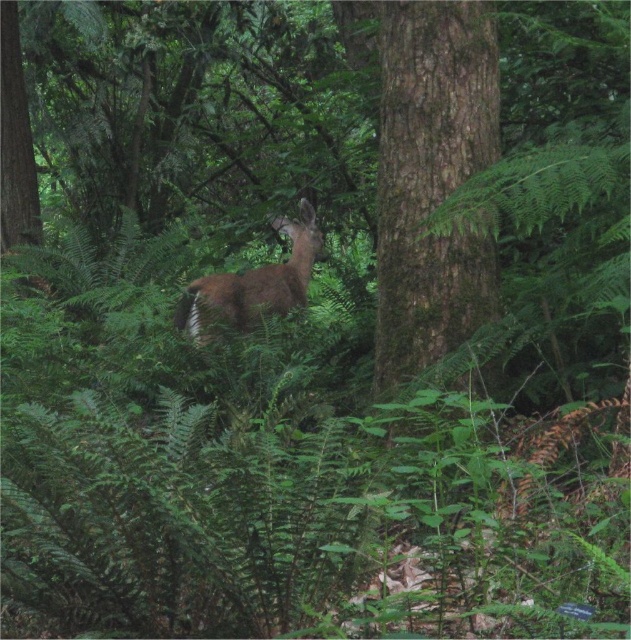
Question: Is brown rough bark tree at center bigger than brown furry deer at center?

Choices:
 (A) yes
 (B) no

Answer: (B)

Question: Which object appears farthest from the camera in this image?

Choices:
 (A) brown rough bark tree at center
 (B) brown furry deer at center

Answer: (B)

Question: Considering the relative positions of brown rough bark tree at center and brown furry deer at center in the image provided, where is brown rough bark tree at center located with respect to brown furry deer at center?

Choices:
 (A) right
 (B) left

Answer: (A)

Question: Which point is closer to the camera?

Choices:
 (A) (380, 291)
 (B) (286, 289)

Answer: (A)

Question: Among these points, which one is nearest to the camera?

Choices:
 (A) (451, 179)
 (B) (180, 301)

Answer: (A)

Question: Can you confirm if brown rough bark tree at center is positioned to the right of brown furry deer at center?

Choices:
 (A) yes
 (B) no

Answer: (A)